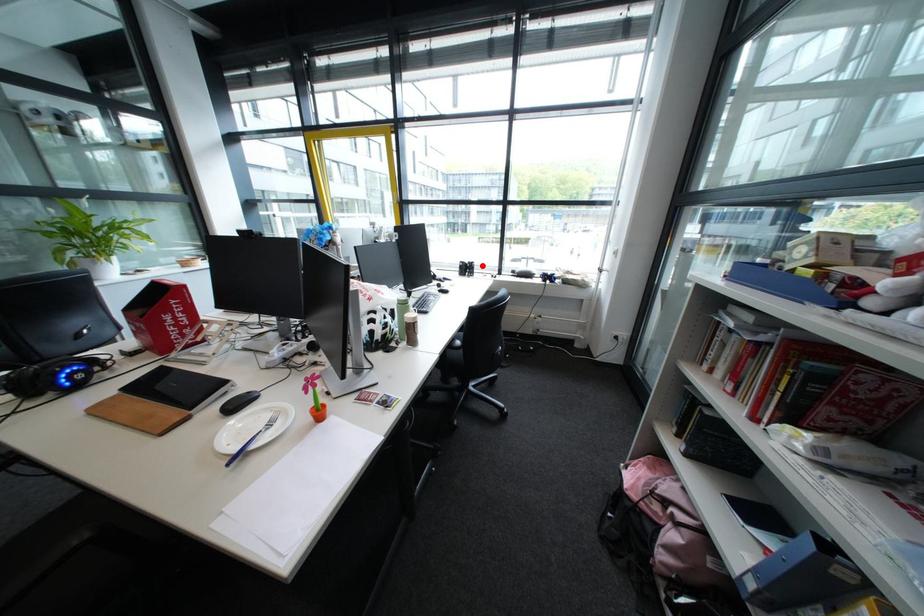
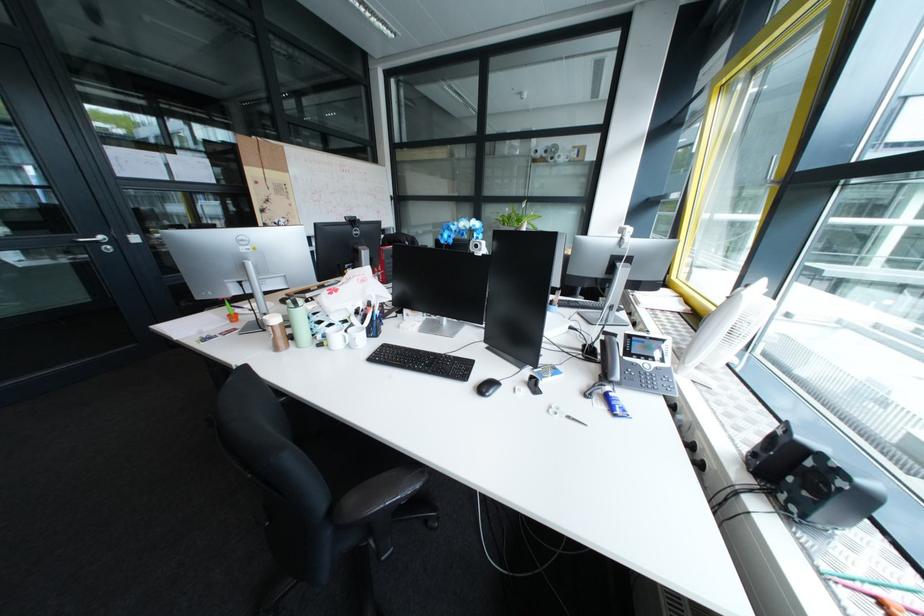
Find the pixel in the second image that matches the highlighted location in the first image.

(823, 464)